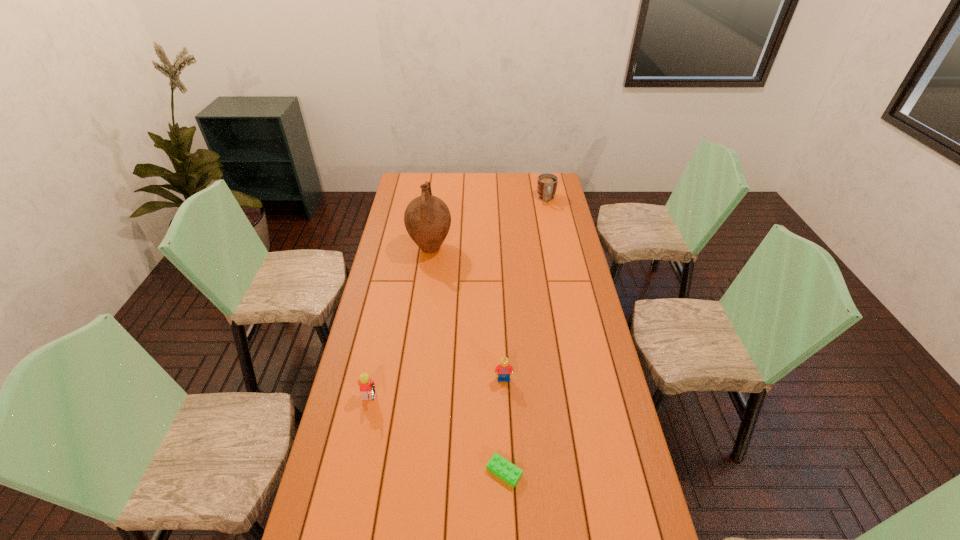
This screenshot has height=540, width=960. In the image, there is a desktop. In order to click on vacant space at the left edge in this screenshot , I will do `click(370, 508)`.

Image resolution: width=960 pixels, height=540 pixels. Identify the location of blank space at the right edge of the desktop. (594, 501).

Locate an element on the screen. The height and width of the screenshot is (540, 960). free space that is in between the pitcher and the rightmost object is located at coordinates (489, 224).

You are a GUI agent. You are given a task and a screenshot of the screen. Output one action in this format:
    pyautogui.click(x=<x>, y=<y>)
    Task: Click on the free space between the third nearest object and the tallest object
    
    Given the screenshot: What is the action you would take?
    pyautogui.click(x=467, y=314)

The image size is (960, 540). Identify the location of vacant area that lies between the rightmost object and the leftmost Lego. (458, 301).

Where is `free space between the nearest object and the mug`? This screenshot has height=540, width=960. free space between the nearest object and the mug is located at coordinates (525, 335).

This screenshot has height=540, width=960. I want to click on the fourth closest object relative to the rightmost object, so click(x=499, y=466).

At what (x,y) coordinates should I click in order to perform the action: click on object that is the second nearest to the nearest object. Please return your answer as a coordinate pair (x, y). This screenshot has width=960, height=540. Looking at the image, I should click on (367, 386).

The width and height of the screenshot is (960, 540). I want to click on Lego that can be found as the third closest to the second farthest object, so (x=499, y=466).

Select which Lego appears as the closest to the leftmost Lego. Please provide its 2D coordinates. Your answer should be formatted as a tuple, i.e. [(x, y)], where the tuple contains the x and y coordinates of a point satisfying the conditions above.

[(499, 466)]